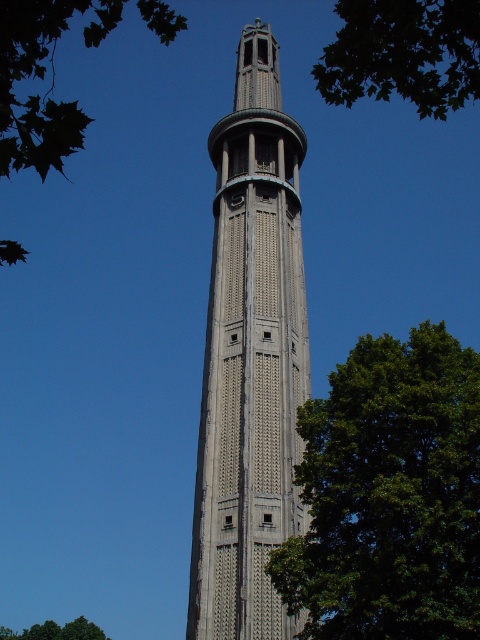
You are an architect analyzing the proportions of the scene. Which object has a narrower width when comparing the gray stone tower at center and the green leafy tree at upper left?

The gray stone tower at center is thinner than the green leafy tree at upper left, so it has a narrower width.

You are an architect analyzing the symmetry of the tower. Based on the placement of the green leafy tree at upper right and the green leafy tree at upper left, does the tower have symmetrical trees on both sides?

The green leafy tree at upper right is positioned over the green leafy tree at upper left, which means they are not placed symmetrically on either side of the tower.

You are standing in front of the tower and want to take a photo. There are two points on the tower that you need to focus on. One is located at coordinates point (420,10) and the other at point (66,108). Which point should you focus on first to ensure both are in clear view?

You should focus on point (420,10) first because it is closer to you than point (66,108), allowing both points to be in clear view.